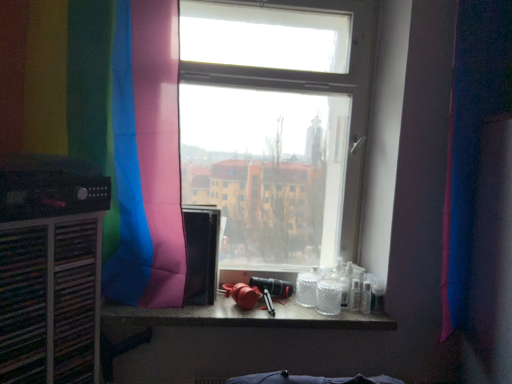
Question: Is pink fabric curtain at right, the second curtain from the left, positioned with its back to transparent glass window at center?

Choices:
 (A) no
 (B) yes

Answer: (A)

Question: Is pink fabric curtain at right, the 1th curtain in the right-to-left sequence, positioned beyond the bounds of transparent glass window at center?

Choices:
 (A) yes
 (B) no

Answer: (A)

Question: From the image's perspective, is pink fabric curtain at right, the 1th curtain in the right-to-left sequence, located beneath transparent glass window at center?

Choices:
 (A) no
 (B) yes

Answer: (B)

Question: Is pink fabric curtain at right, the 1th curtain in the right-to-left sequence, far away from transparent glass window at center?

Choices:
 (A) no
 (B) yes

Answer: (A)

Question: Considering the relative sizes of pink fabric curtain at right, the second curtain from the left, and transparent glass window at center in the image provided, is pink fabric curtain at right, the second curtain from the left, bigger than transparent glass window at center?

Choices:
 (A) no
 (B) yes

Answer: (A)

Question: Can transparent glass window at center be found inside pink fabric curtain at right, the second curtain from the left?

Choices:
 (A) yes
 (B) no

Answer: (B)

Question: Is transparent glass window at center outside black matte speaker at left?

Choices:
 (A) yes
 (B) no

Answer: (A)

Question: Is transparent glass window at center looking in the opposite direction of black matte speaker at left?

Choices:
 (A) yes
 (B) no

Answer: (B)

Question: Is transparent glass window at center smaller than black matte speaker at left?

Choices:
 (A) yes
 (B) no

Answer: (B)

Question: Can you confirm if transparent glass window at center is bigger than black matte speaker at left?

Choices:
 (A) yes
 (B) no

Answer: (A)

Question: Considering the relative positions of transparent glass window at center and black matte speaker at left in the image provided, is transparent glass window at center behind black matte speaker at left?

Choices:
 (A) yes
 (B) no

Answer: (A)

Question: From a real-world perspective, is transparent glass window at center below black matte speaker at left?

Choices:
 (A) no
 (B) yes

Answer: (A)

Question: From a real-world perspective, is black matte speaker at left beneath translucent glass counter top at center?

Choices:
 (A) yes
 (B) no

Answer: (B)